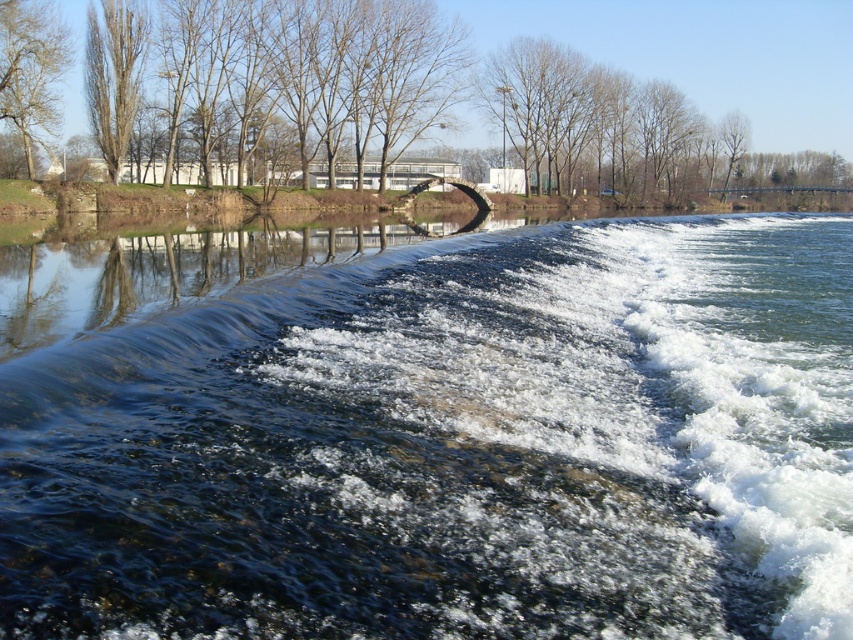
Can you confirm if clear water at center is wider than brown leafless tree at upper left?

In fact, clear water at center might be narrower than brown leafless tree at upper left.

Can you confirm if clear water at center is smaller than brown leafless tree at upper left?

Yes, clear water at center is smaller than brown leafless tree at upper left.

Where is `clear water at center`? clear water at center is located at coordinates [x=456, y=449].

Can you confirm if clear water at center is bigger than smooth bark tree at upper left?

Yes.

Between clear water at center and smooth bark tree at upper left, which one has less height?

Standing shorter between the two is clear water at center.

Between point (109, 570) and point (36, 36), which one is positioned behind?

Positioned behind is point (36, 36).

You are a GUI agent. You are given a task and a screenshot of the screen. Output one action in this format:
    pyautogui.click(x=<x>, y=<y>)
    Task: Click on the clear water at center
    
    Given the screenshot: What is the action you would take?
    pyautogui.click(x=456, y=449)

I want to click on brown leafless tree at upper left, so click(x=273, y=81).

Can you confirm if brown leafless tree at upper left is bigger than smooth bark tree at upper left?

Yes, brown leafless tree at upper left is bigger than smooth bark tree at upper left.

Between point (550, 88) and point (39, 86), which one is positioned in front?

Point (39, 86) is in front.

Identify the location of brown leafless tree at upper left. (273, 81).